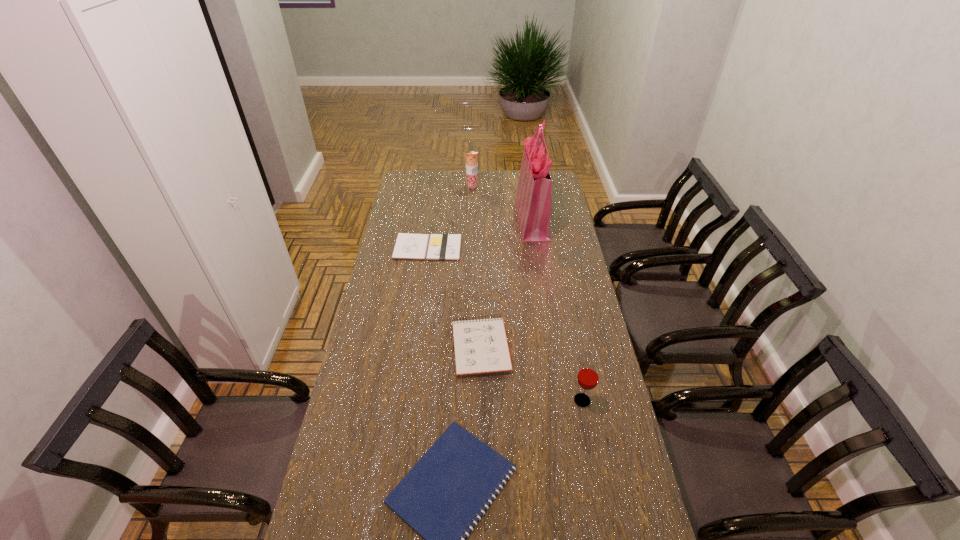
This screenshot has width=960, height=540. What are the coordinates of `free region located on the front of the farthest object` in the screenshot? It's located at (471, 221).

This screenshot has width=960, height=540. I want to click on vacant area situated 0.190m on the left of the second nearest object, so click(514, 401).

I want to click on free spot located on the front of the fourth tallest object, so tap(481, 405).

Identify the location of vacant region located on the back of the farthest notepad. (432, 219).

Where is `object that is positioned at the far edge`? object that is positioned at the far edge is located at coordinates (471, 158).

Identify the location of object that is positioned at the left edge. This screenshot has width=960, height=540. (407, 246).

Where is `shopping bag that is at the right edge`? shopping bag that is at the right edge is located at coordinates (532, 203).

The image size is (960, 540). What are the coordinates of `glass that is positioned at the right edge` in the screenshot? It's located at (588, 376).

The width and height of the screenshot is (960, 540). I want to click on blank space at the far edge, so click(504, 183).

This screenshot has height=540, width=960. In the image, there is a desktop. What are the coordinates of `vacant area at the left edge` in the screenshot? It's located at (402, 314).